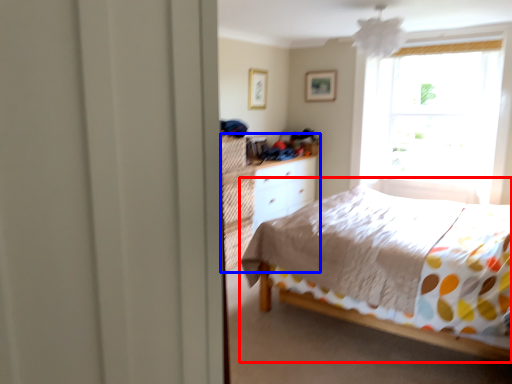
Question: Which point is closer to the camera, bed (highlighted by a red box) or dresser (highlighted by a blue box)?

Choices:
 (A) bed
 (B) dresser

Answer: (A)